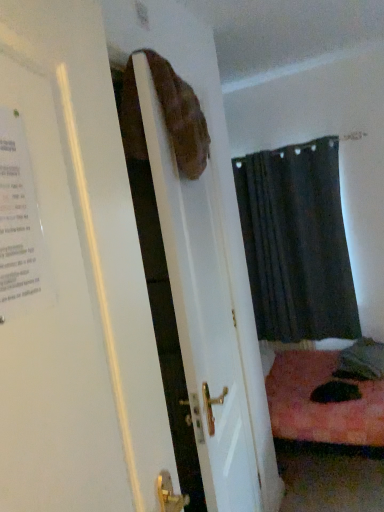
This screenshot has width=384, height=512. Describe the element at coordinates (78, 285) in the screenshot. I see `matte brown bag at upper center` at that location.

Identify the location of dark fabric curtain at center. This screenshot has width=384, height=512. (297, 242).

This screenshot has width=384, height=512. I want to click on matte brown bag at upper center, so [x=78, y=285].

From the image's perspective, is matte brown bag at upper center under white paper poster at left?

Yes.

Considering the positions of points (113, 231) and (26, 307), is point (113, 231) closer to camera compared to point (26, 307)?

No.

Is matte brown bag at upper center inside the boundaries of white paper poster at left, or outside?

matte brown bag at upper center is not inside white paper poster at left, it's outside.

Looking at this image, from a real-world perspective, is matte brown bag at upper center below white paper poster at left?

Correct, in the physical world, matte brown bag at upper center is lower than white paper poster at left.

Is white paper poster at left surrounded by dark fabric curtain at center?

Definitely not — white paper poster at left is not inside dark fabric curtain at center.

Which object is thinner, dark fabric curtain at center or white paper poster at left?

Thinner between the two is white paper poster at left.

From a real-world perspective, does dark fabric curtain at center stand above white paper poster at left?

No, from a real-world perspective, dark fabric curtain at center is not above white paper poster at left.

How different are the orientations of matte brown bag at upper center and dark fabric curtain at center in degrees?

The facing directions of matte brown bag at upper center and dark fabric curtain at center are 87.8 degrees apart.

Based on the photo, from the image's perspective, does matte brown bag at upper center appear lower than dark fabric curtain at center?

Correct, matte brown bag at upper center appears lower than dark fabric curtain at center in the image.

At what (x,y) coordinates should I click in order to perform the action: click on door located above the dark fabric curtain at center (from a real-world perspective). Please return your answer as a coordinate pair (x, y). Looking at the image, I should click on (78, 285).

Can you confirm if matte brown bag at upper center is thinner than dark fabric curtain at center?

Correct, the width of matte brown bag at upper center is less than that of dark fabric curtain at center.

Is matte brown bag at upper center inside white paper poster at left?

Definitely not — matte brown bag at upper center is not inside white paper poster at left.

Who is shorter, white paper poster at left or matte brown bag at upper center?

With less height is white paper poster at left.

At what (x,y) coordinates should I click in order to perform the action: click on poster lying above the matte brown bag at upper center (from the image's perspective). Please return your answer as a coordinate pair (x, y). This screenshot has height=512, width=384. Looking at the image, I should click on (20, 227).

Is white paper poster at left smaller than matte brown bag at upper center?

Yes, white paper poster at left is smaller than matte brown bag at upper center.

How far apart are dark fabric curtain at center and matte brown bag at upper center?

dark fabric curtain at center and matte brown bag at upper center are 7.82 feet apart from each other.

Is dark fabric curtain at center oriented towards matte brown bag at upper center?

Yes, dark fabric curtain at center is aimed at matte brown bag at upper center.

From a real-world perspective, is dark fabric curtain at center physically above matte brown bag at upper center?

Actually, dark fabric curtain at center is physically below matte brown bag at upper center in the real world.

From the image's perspective, which one is positioned lower, dark fabric curtain at center or matte brown bag at upper center?

From the image's view, matte brown bag at upper center is below.

Find the location of a particular element. curtain located on the right of white paper poster at left is located at coordinates (297, 242).

Relative to dark fabric curtain at center, is white paper poster at left in front or behind?

white paper poster at left is positioned closer to the viewer than dark fabric curtain at center.

How different are the orientations of white paper poster at left and dark fabric curtain at center in degrees?

The angle between the facing direction of white paper poster at left and the facing direction of dark fabric curtain at center is 87.8 degrees.

At what (x,y) coordinates should I click in order to perform the action: click on door that appears on the right of white paper poster at left. Please return your answer as a coordinate pair (x, y). Image resolution: width=384 pixels, height=512 pixels. Looking at the image, I should click on (78, 285).

You are a GUI agent. You are given a task and a screenshot of the screen. Output one action in this format:
    pyautogui.click(x=<x>, y=<y>)
    Task: Click on the curtain below the white paper poster at left (from a real-world perspective)
    
    Given the screenshot: What is the action you would take?
    pyautogui.click(x=297, y=242)

Estimate the real-world distances between objects in this image. Which object is further from white paper poster at left, matte brown bag at upper center or dark fabric curtain at center?

dark fabric curtain at center lies further to white paper poster at left than the other object.

Estimate the real-world distances between objects in this image. Which object is further from matte brown bag at upper center, dark fabric curtain at center or white paper poster at left?

The object further to matte brown bag at upper center is dark fabric curtain at center.

Based on their spatial positions, is matte brown bag at upper center or white paper poster at left closer to dark fabric curtain at center?

matte brown bag at upper center lies closer to dark fabric curtain at center than the other object.

Which object lies further to the anchor point matte brown bag at upper center, white paper poster at left or dark fabric curtain at center?

dark fabric curtain at center is further to matte brown bag at upper center.

Looking at the image, which one is located further to white paper poster at left, dark fabric curtain at center or matte brown bag at upper center?

dark fabric curtain at center.

Which object lies nearer to the anchor point dark fabric curtain at center, white paper poster at left or matte brown bag at upper center?

Based on the image, matte brown bag at upper center appears to be nearer to dark fabric curtain at center.

The width and height of the screenshot is (384, 512). I want to click on poster between matte brown bag at upper center and dark fabric curtain at center in the front-back direction, so click(20, 227).